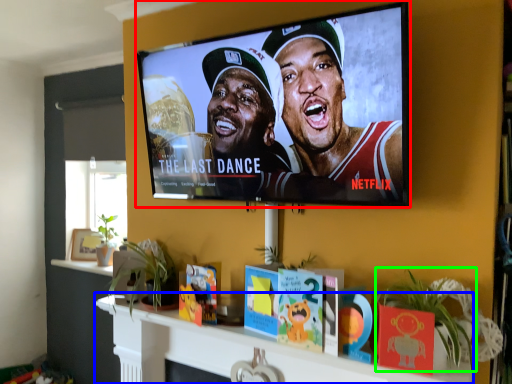
Question: Considering the real-world distances, which object is farthest from television (highlighted by a red box)? shelf (highlighted by a blue box) or plant (highlighted by a green box)?

Choices:
 (A) shelf
 (B) plant

Answer: (A)